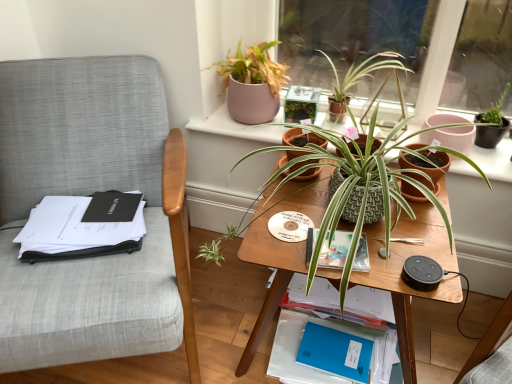
Question: Would you consider textured terracotta pot at center, positioned as the third houseplant in top-to-bottom order, to be distant from blue matte paperback book at lower center, which is the 1th paperback book in back-to-front order?

Choices:
 (A) no
 (B) yes

Answer: (A)

Question: Does textured terracotta pot at center, which is the first houseplant in bottom-to-top order, appear on the right side of blue matte paperback book at lower center, which ranks as the 2th paperback book in top-to-bottom order?

Choices:
 (A) yes
 (B) no

Answer: (B)

Question: Considering the relative sizes of textured terracotta pot at center, positioned as the third houseplant in top-to-bottom order, and blue matte paperback book at lower center, which ranks as the 2th paperback book in top-to-bottom order, in the image provided, is textured terracotta pot at center, positioned as the third houseplant in top-to-bottom order, taller than blue matte paperback book at lower center, which ranks as the 2th paperback book in top-to-bottom order,?

Choices:
 (A) yes
 (B) no

Answer: (A)

Question: Would you say textured terracotta pot at center, which is the first houseplant in bottom-to-top order, is outside blue matte paperback book at lower center, the first paperback book from the bottom?

Choices:
 (A) yes
 (B) no

Answer: (A)

Question: Is blue matte paperback book at lower center, the first paperback book from the bottom, completely or partially inside textured terracotta pot at center, which is the first houseplant in bottom-to-top order?

Choices:
 (A) yes
 (B) no

Answer: (B)

Question: From a real-world perspective, is blue matte paperback book at lower center, the first paperback book from the bottom, above or below green textured pot at center, placed as the 2th flowerpot when sorted from right to left?

Choices:
 (A) above
 (B) below

Answer: (B)

Question: Is blue matte paperback book at lower center, which is the 1th paperback book in back-to-front order, wider or thinner than green textured pot at center, which appears as the first flowerpot when viewed from the left?

Choices:
 (A) thin
 (B) wide

Answer: (B)

Question: Considering the positions of blue matte paperback book at lower center, which is the 1th paperback book in back-to-front order, and green textured pot at center, placed as the 2th flowerpot when sorted from right to left, in the image, is blue matte paperback book at lower center, which is the 1th paperback book in back-to-front order, taller or shorter than green textured pot at center, placed as the 2th flowerpot when sorted from right to left,?

Choices:
 (A) tall
 (B) short

Answer: (B)

Question: From the image's perspective, is blue matte paperback book at lower center, which is the 1th paperback book in back-to-front order, located above or below green textured pot at center, which appears as the first flowerpot when viewed from the left?

Choices:
 (A) below
 (B) above

Answer: (A)

Question: Based on their sizes in the image, would you say hardcover book at center, arranged as the 2th paperback book when ordered from the bottom, is bigger or smaller than textured terracotta pot at center, positioned as the third houseplant in top-to-bottom order?

Choices:
 (A) small
 (B) big

Answer: (A)

Question: From a real-world perspective, is hardcover book at center, which is the first paperback book from front to back, above or below textured terracotta pot at center, which is the first houseplant in bottom-to-top order?

Choices:
 (A) above
 (B) below

Answer: (B)

Question: Considering the positions of hardcover book at center, which is the first paperback book from front to back, and textured terracotta pot at center, positioned as the third houseplant in top-to-bottom order, in the image, is hardcover book at center, which is the first paperback book from front to back, wider or thinner than textured terracotta pot at center, positioned as the third houseplant in top-to-bottom order,?

Choices:
 (A) thin
 (B) wide

Answer: (A)

Question: Is hardcover book at center, which appears as the 2th paperback book when viewed from the back, inside or outside of textured terracotta pot at center, positioned as the third houseplant in top-to-bottom order?

Choices:
 (A) inside
 (B) outside

Answer: (A)

Question: Would you say terracotta clay pot at center-right, the 1th flowerpot viewed from the right, is to the left or to the right of blue matte notebook at lower center in the picture?

Choices:
 (A) right
 (B) left

Answer: (A)

Question: From a real-world perspective, relative to blue matte notebook at lower center, is terracotta clay pot at center-right, which is counted as the second flowerpot, starting from the left, vertically above or below?

Choices:
 (A) above
 (B) below

Answer: (A)